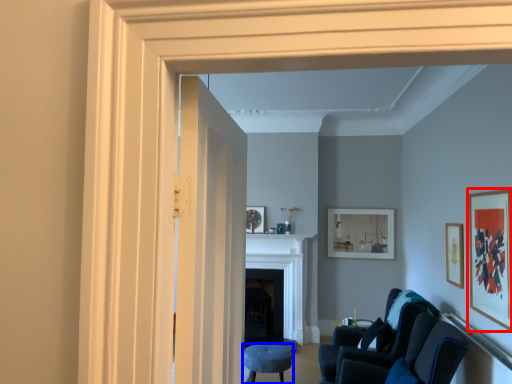
Question: Among these objects, which one is nearest to the camera, picture frame (highlighted by a red box) or furniture (highlighted by a blue box)?

Choices:
 (A) picture frame
 (B) furniture

Answer: (A)